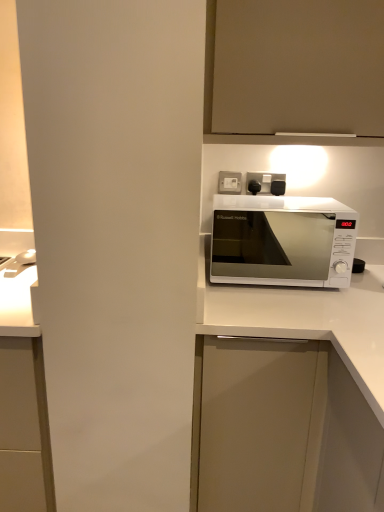
Question: Does point (271, 48) appear closer or farther from the camera than point (226, 197)?

Choices:
 (A) farther
 (B) closer

Answer: (B)

Question: Relative to white glossy microwave at center, is matte white cabinet at upper center, which is counted as the 2th cabinetry, starting from the bottom, in front or behind?

Choices:
 (A) front
 (B) behind

Answer: (A)

Question: Estimate the real-world distances between objects in this image. Which object is closer to the white glossy microwave at center?

Choices:
 (A) white matte cabinet at center, which appears as the 2th cabinetry when viewed from the top
 (B) white plastic socket at upper center
 (C) matte white cabinet at upper center, which is counted as the 2th cabinetry, starting from the bottom

Answer: (B)

Question: Which object is positioned closest to the white plastic socket at upper center?

Choices:
 (A) matte white cabinet at upper center, which is counted as the 2th cabinetry, starting from the bottom
 (B) white matte cabinet at center, which is the 1th cabinetry in bottom-to-top order
 (C) white glossy microwave at center

Answer: (A)